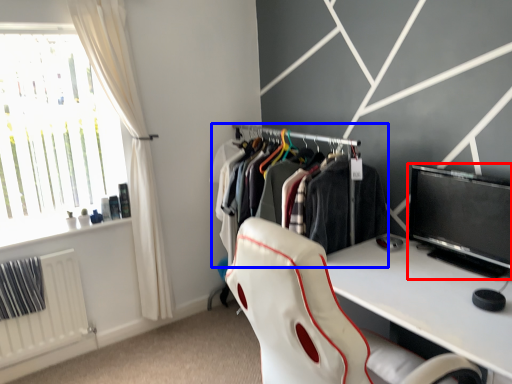
Question: Which of the following is the closest to the observer, computer monitor (highlighted by a red box) or closet (highlighted by a blue box)?

Choices:
 (A) computer monitor
 (B) closet

Answer: (A)